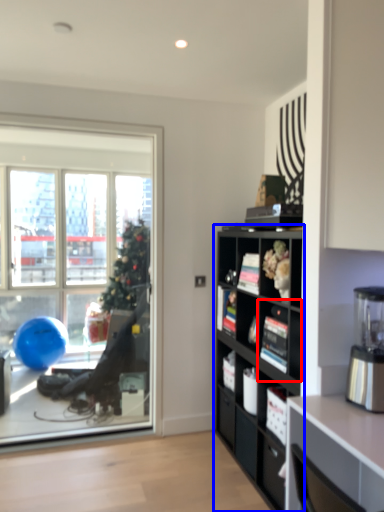
Question: Which object appears farthest to the camera in this image, shelf (highlighted by a red box) or cabinetry (highlighted by a blue box)?

Choices:
 (A) shelf
 (B) cabinetry

Answer: (A)